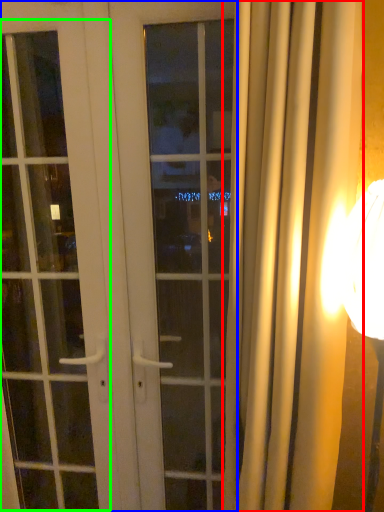
Question: Which object is the farthest from curtain (highlighted by a red box)? Choose among these: door (highlighted by a blue box) or screen door (highlighted by a green box).

Choices:
 (A) door
 (B) screen door

Answer: (B)